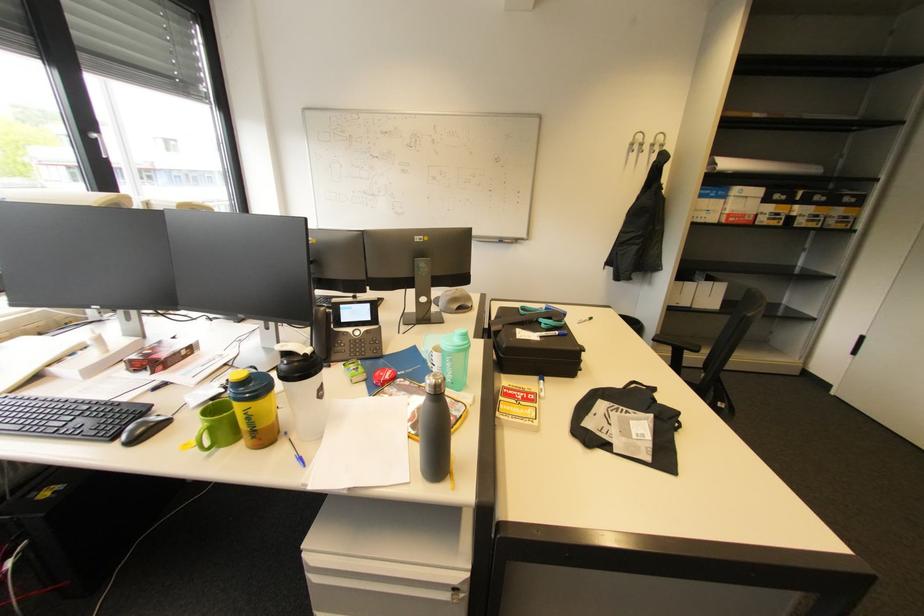
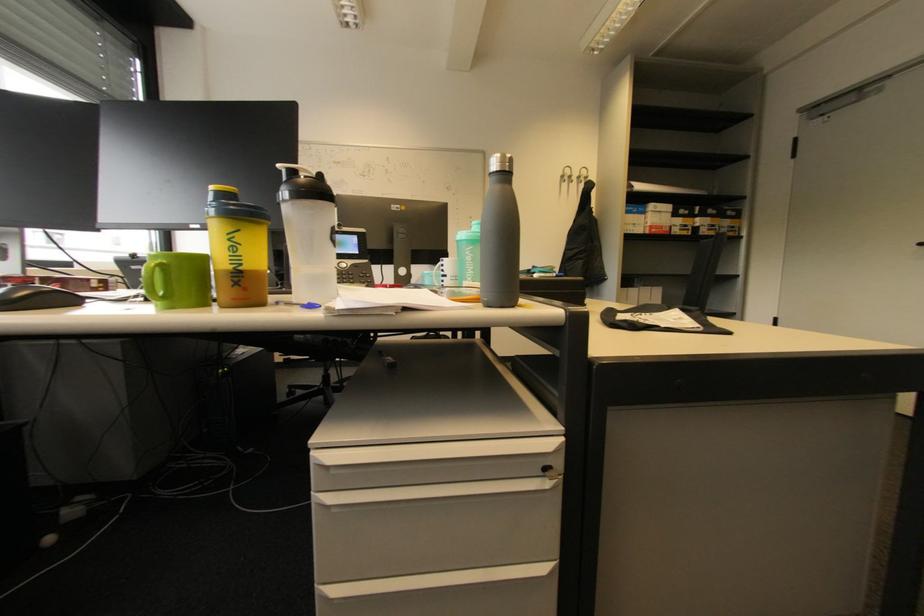
Find the pixel in the second image that matches point 658,146 in the first image.

(584, 177)